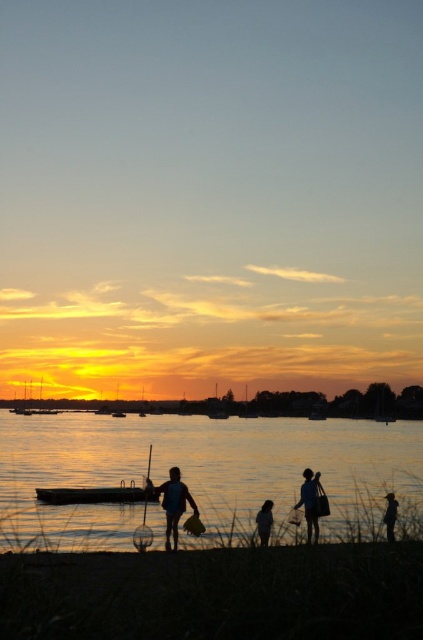
Question: Which object is closer to the camera taking this photo?

Choices:
 (A) wooden canoe at center
 (B) silhouette fabric person at lower center

Answer: (B)

Question: Considering the real-world distances, which object is closest to the silhouette swimmer at center?

Choices:
 (A) silvery water at lower center
 (B) wooden canoe at center
 (C) silhouette figure at lower right

Answer: (B)

Question: Which is nearer to the dark sand at lower center?

Choices:
 (A) silhouette fabric person at lower center
 (B) wooden canoe at center
 (C) silhouette backpack at lower right
 (D) silhouette swimmer at center

Answer: (A)

Question: Can you confirm if wooden canoe at center is positioned to the right of silhouette backpack at lower right?

Choices:
 (A) no
 (B) yes

Answer: (A)

Question: Does dark sand at lower center have a larger size compared to silhouette figure at lower right?

Choices:
 (A) yes
 (B) no

Answer: (A)

Question: Is wooden canoe at center wider than silhouette backpack at lower right?

Choices:
 (A) yes
 (B) no

Answer: (A)